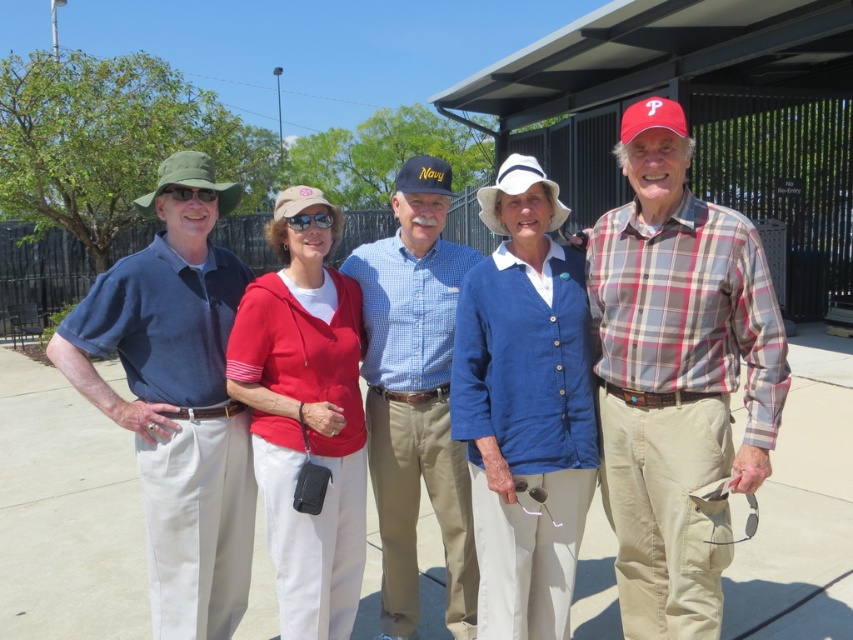
You are trying to decide whether to place a small potted plant between the matte blue shirt at center and the green fabric hat at left. Based on their sizes, will the plant fit comfortably between them?

The matte blue shirt at center might be wider than the green fabric hat at left, so there might be enough space for the plant to fit comfortably between them.